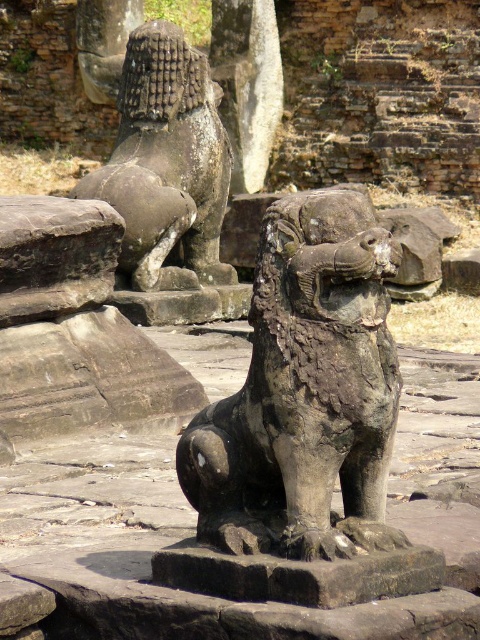
Is stone textured lion at center further to the viewer compared to gray stone lion at upper left?

That is False.

Which of these two, stone textured lion at center or gray stone lion at upper left, stands taller?

With more height is gray stone lion at upper left.

The height and width of the screenshot is (640, 480). Identify the location of stone textured lion at center. (304, 392).